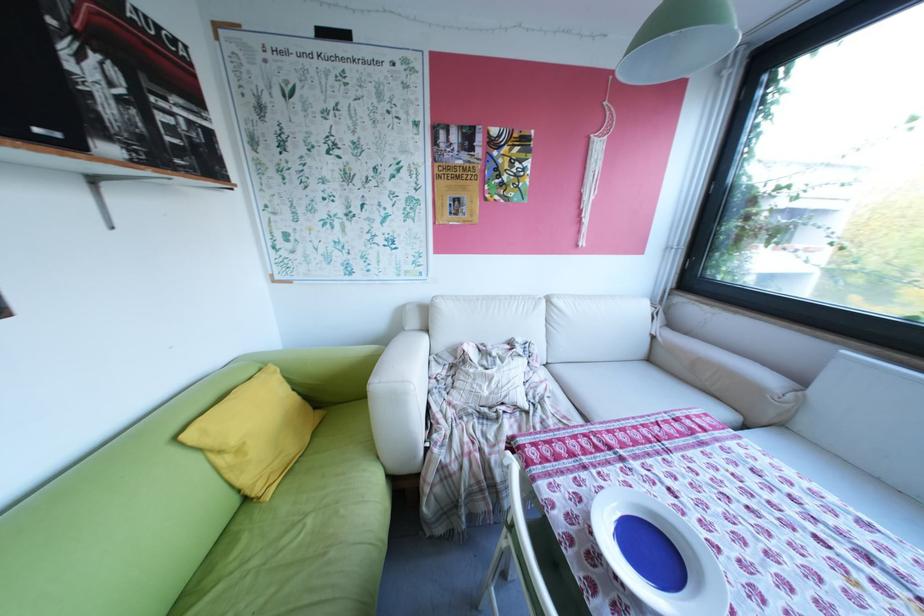
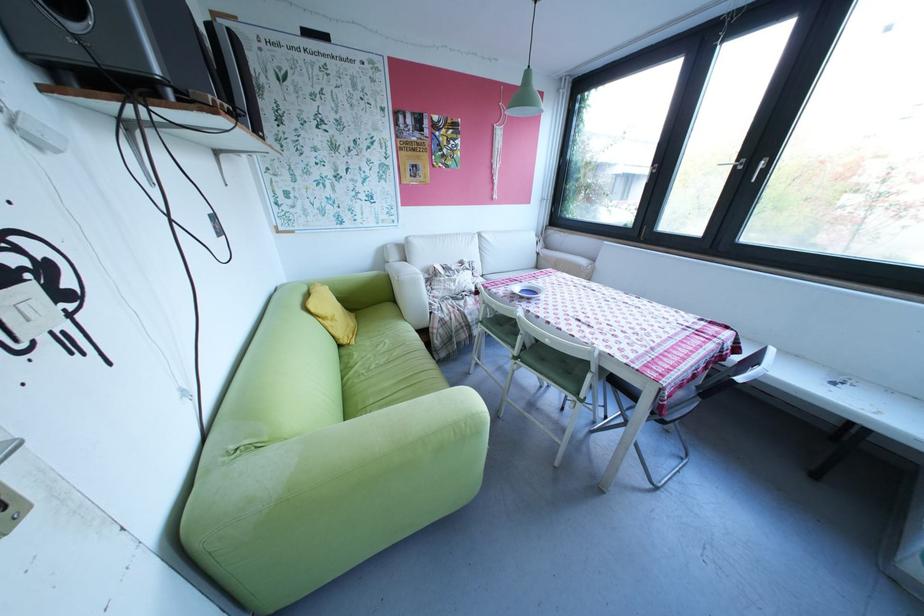
Where in the second image is the point corresponding to point 281,496 from the first image?

(366, 342)